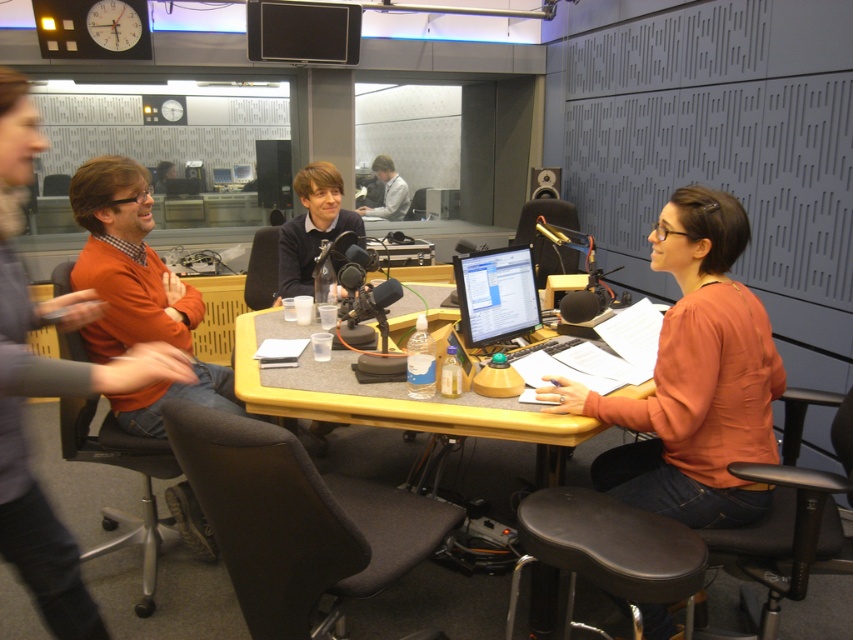
Question: Does black leather stool at lower center come in front of matte black microphone at center?

Choices:
 (A) no
 (B) yes

Answer: (B)

Question: Estimate the real-world distances between objects in this image. Which object is farther from the light gray shirt at center?

Choices:
 (A) orange fabric shirt at center
 (B) matte orange sweater at left

Answer: (B)

Question: Which object is the farthest from the light gray shirt at center?

Choices:
 (A) yellow matte table at center
 (B) dark gray fabric chair at center

Answer: (B)

Question: Which of the following is the farthest from the observer?

Choices:
 (A) (317, 392)
 (B) (296, 250)
 (C) (158, 170)
 (D) (73, 317)

Answer: (C)

Question: Considering the relative positions of black leather stool at lower center and matte black microphone at center in the image provided, where is black leather stool at lower center located with respect to matte black microphone at center?

Choices:
 (A) left
 (B) right

Answer: (B)

Question: Can you confirm if matte orange sweater at left is wider than orange sweater at left?

Choices:
 (A) no
 (B) yes

Answer: (A)